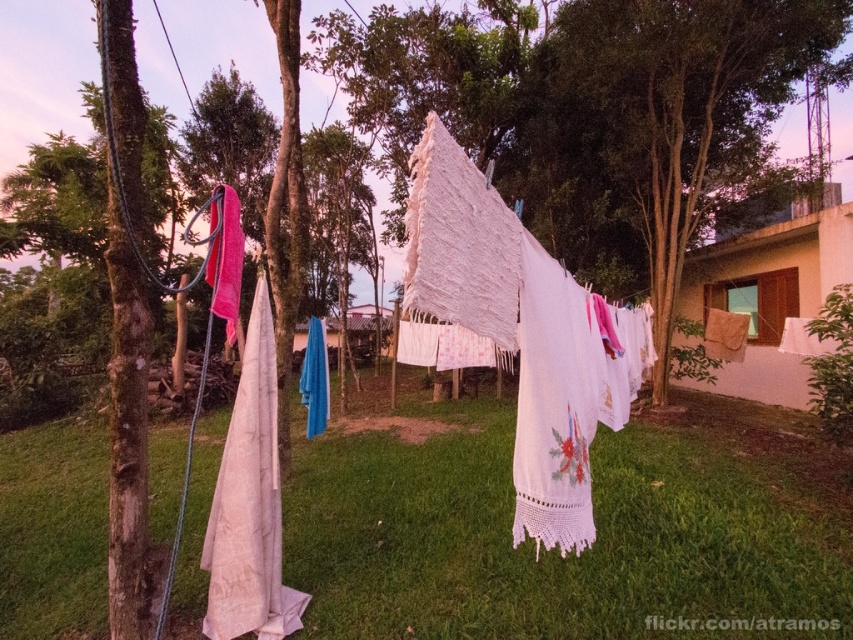
Question: Is green grass at center wider than blue fabric at center?

Choices:
 (A) no
 (B) yes

Answer: (B)

Question: Which object appears farthest from the camera in this image?

Choices:
 (A) green grass at center
 (B) blue fabric at center
 (C) white cotton cloth at center

Answer: (B)

Question: Does green grass at center appear over white cotton cloth at center?

Choices:
 (A) yes
 (B) no

Answer: (B)

Question: Is white crochet towel at center to the left of blue fabric at center from the viewer's perspective?

Choices:
 (A) no
 (B) yes

Answer: (A)

Question: Estimate the real-world distances between objects in this image. Which object is closer to the white cotton cloth at center?

Choices:
 (A) white crochet towel at center
 (B) green grass at center

Answer: (A)

Question: Which point is farther to the camera?

Choices:
 (A) white crochet towel at center
 (B) white lace towel at left
 (C) green grass at center

Answer: (B)